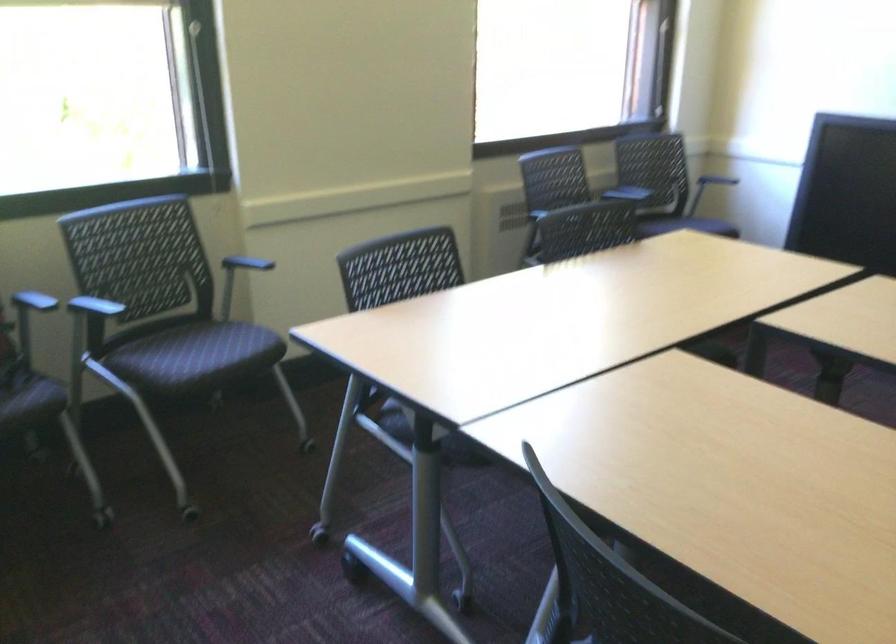
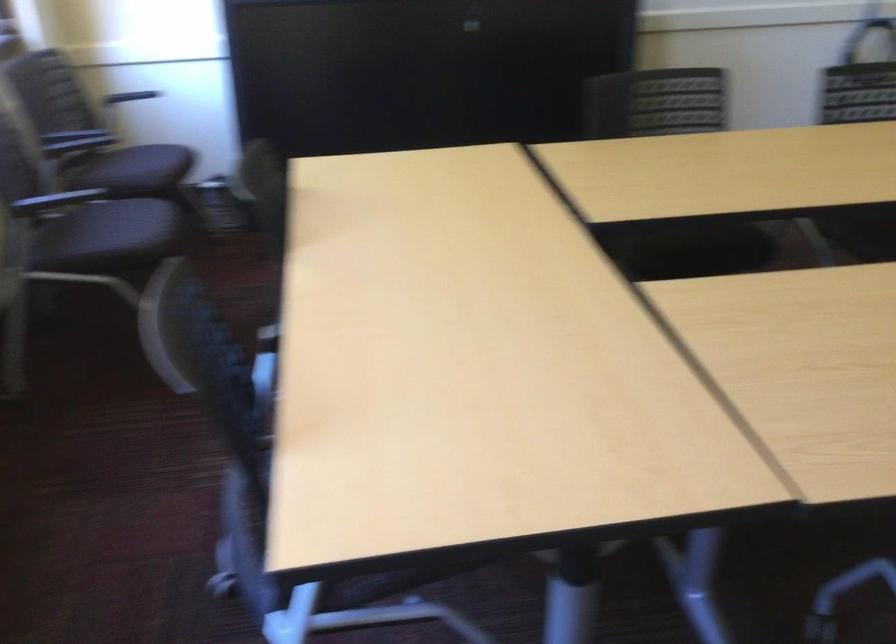
Where in the second image is the point corresponding to the point at 729,176 from the first image?

(131, 96)